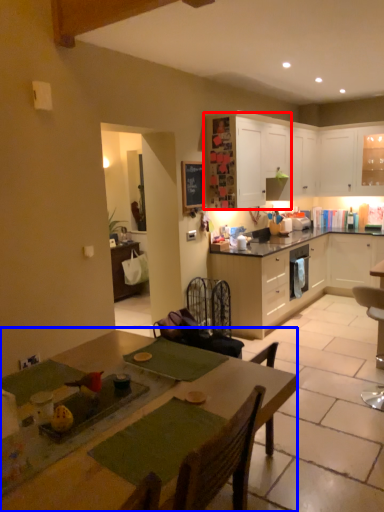
Question: Which of the following is the closest to the observer, cabinetry (highlighted by a red box) or table (highlighted by a blue box)?

Choices:
 (A) cabinetry
 (B) table

Answer: (B)